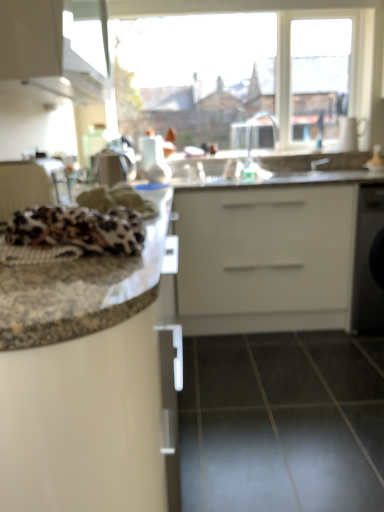
Question: Is white glossy cabinet at upper left oriented away from silver metallic faucet at upper center?

Choices:
 (A) yes
 (B) no

Answer: (B)

Question: From a real-world perspective, is white glossy cabinet at upper left below silver metallic faucet at upper center?

Choices:
 (A) yes
 (B) no

Answer: (B)

Question: Could you tell me if white glossy cabinet at upper left is turned towards silver metallic faucet at upper center?

Choices:
 (A) yes
 (B) no

Answer: (A)

Question: Considering the relative positions of white glossy cabinet at upper left and silver metallic faucet at upper center in the image provided, is white glossy cabinet at upper left in front of silver metallic faucet at upper center?

Choices:
 (A) yes
 (B) no

Answer: (A)

Question: From the image's perspective, is white glossy cabinet at upper left on silver metallic faucet at upper center?

Choices:
 (A) no
 (B) yes

Answer: (B)

Question: From the image's perspective, relative to leopard print fabric at left, is white glossy cabinet at upper left above or below?

Choices:
 (A) above
 (B) below

Answer: (A)

Question: From a real-world perspective, is white glossy cabinet at upper left above or below leopard print fabric at left?

Choices:
 (A) below
 (B) above

Answer: (B)

Question: In terms of size, does white glossy cabinet at upper left appear bigger or smaller than leopard print fabric at left?

Choices:
 (A) big
 (B) small

Answer: (A)

Question: Considering the positions of white glossy cabinet at upper left and leopard print fabric at left in the image, is white glossy cabinet at upper left taller or shorter than leopard print fabric at left?

Choices:
 (A) short
 (B) tall

Answer: (B)

Question: Is leopard print fabric at left inside or outside of transparent glass window at upper center?

Choices:
 (A) inside
 (B) outside

Answer: (B)

Question: From the image's perspective, relative to transparent glass window at upper center, is leopard print fabric at left above or below?

Choices:
 (A) above
 (B) below

Answer: (B)

Question: From a real-world perspective, relative to transparent glass window at upper center, is leopard print fabric at left vertically above or below?

Choices:
 (A) below
 (B) above

Answer: (A)

Question: Considering the positions of leopard print fabric at left and transparent glass window at upper center in the image, is leopard print fabric at left bigger or smaller than transparent glass window at upper center?

Choices:
 (A) big
 (B) small

Answer: (B)

Question: Is silver metallic faucet at upper center wider or thinner than granite countertop at left?

Choices:
 (A) thin
 (B) wide

Answer: (A)

Question: Considering the positions of point (248, 128) and point (144, 320), is point (248, 128) closer or farther from the camera than point (144, 320)?

Choices:
 (A) closer
 (B) farther

Answer: (B)